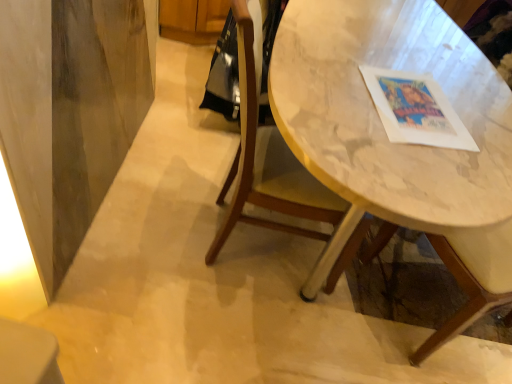
Question: From the image's perspective, is marble table at center positioned above or below wooden chair at center?

Choices:
 (A) above
 (B) below

Answer: (A)

Question: Choose the correct answer: Is marble table at center inside wooden chair at center or outside it?

Choices:
 (A) outside
 (B) inside

Answer: (A)

Question: Would you say marble table at center is to the left or to the right of wooden chair at center in the picture?

Choices:
 (A) right
 (B) left

Answer: (A)

Question: Relative to marble table at center, is wooden chair at center in front or behind?

Choices:
 (A) behind
 (B) front

Answer: (A)

Question: In terms of height, does wooden chair at center look taller or shorter compared to marble table at center?

Choices:
 (A) short
 (B) tall

Answer: (B)

Question: From the image's perspective, is wooden chair at center located above or below marble table at center?

Choices:
 (A) above
 (B) below

Answer: (B)

Question: Considering the positions of point (239, 61) and point (411, 54), is point (239, 61) closer or farther from the camera than point (411, 54)?

Choices:
 (A) closer
 (B) farther

Answer: (B)